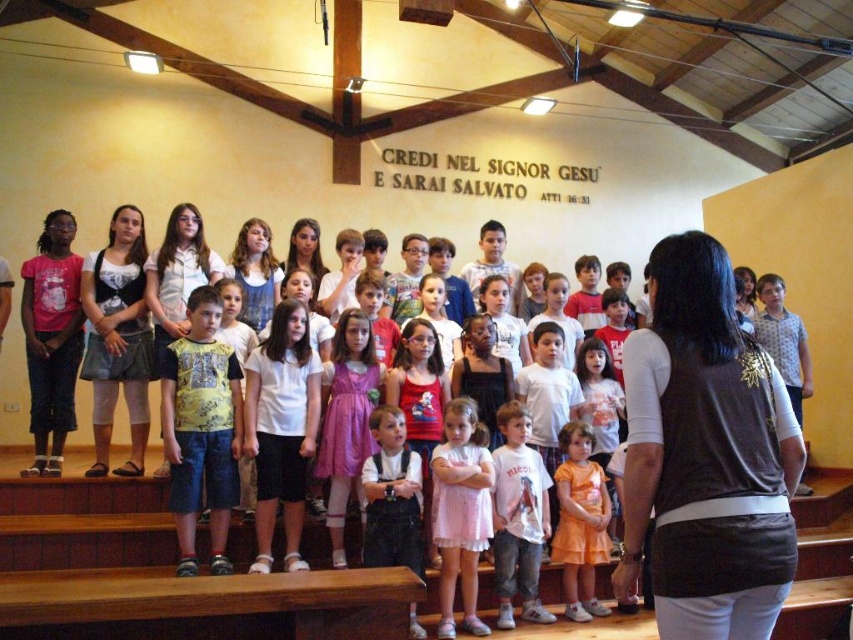
Between point (229, 452) and point (444, 480), which one is positioned behind?

The point (229, 452) is more distant.

Between point (239, 397) and point (483, 426), which one is positioned in front?

Point (483, 426)

Between point (202, 380) and point (454, 493), which one is positioned in front?

Point (454, 493) is in front.

Locate an element on the screen. This screenshot has height=640, width=853. yellow printed t-shirt at center is located at coordinates (201, 429).

Consider the image. Does yellow printed t-shirt at center have a lesser width compared to orange satin dress at center?

Incorrect, yellow printed t-shirt at center's width is not less than orange satin dress at center's.

Which is above, yellow printed t-shirt at center or orange satin dress at center?

yellow printed t-shirt at center

Who is more distant from viewer, (189, 413) or (577, 477)?

The point (577, 477) is more distant.

This screenshot has height=640, width=853. I want to click on yellow printed t-shirt at center, so click(x=201, y=429).

Can you confirm if pink cotton dress at center is positioned above orange satin dress at center?

Correct, pink cotton dress at center is located above orange satin dress at center.

Who is positioned more to the left, pink cotton dress at center or orange satin dress at center?

pink cotton dress at center is more to the left.

Which is behind, point (440, 516) or point (587, 616)?

Point (587, 616)

Find the location of `pink cotton dress at center`. pink cotton dress at center is located at coordinates (461, 512).